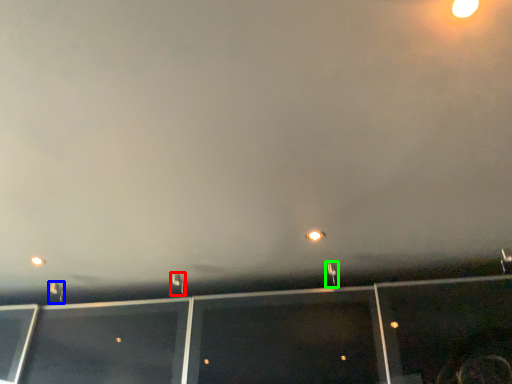
Question: Estimate the real-world distances between objects in this image. Which object is closer to street light (highlighted by a red box), street light (highlighted by a blue box) or street light (highlighted by a green box)?

Choices:
 (A) street light
 (B) street light

Answer: (A)